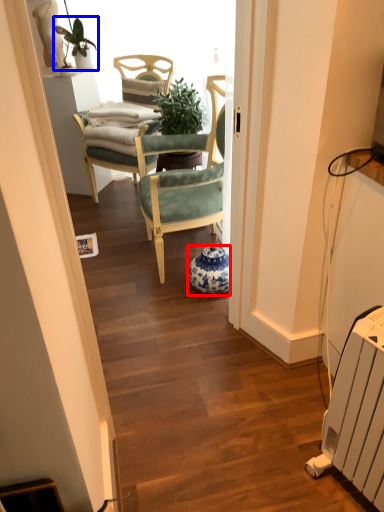
Question: Which object is further to the camera taking this photo, vase (highlighted by a red box) or houseplant (highlighted by a blue box)?

Choices:
 (A) vase
 (B) houseplant

Answer: (B)